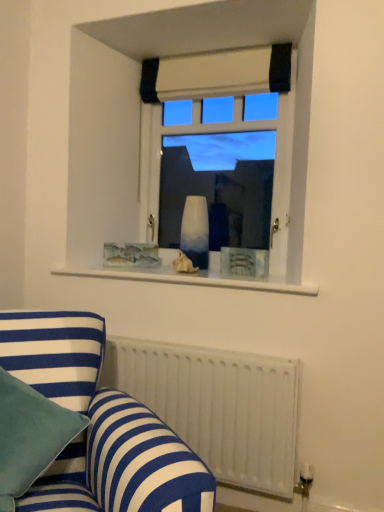
This screenshot has height=512, width=384. I want to click on vacant area on top of beige fabric curtain at upper center (from a real-world perspective), so click(x=213, y=50).